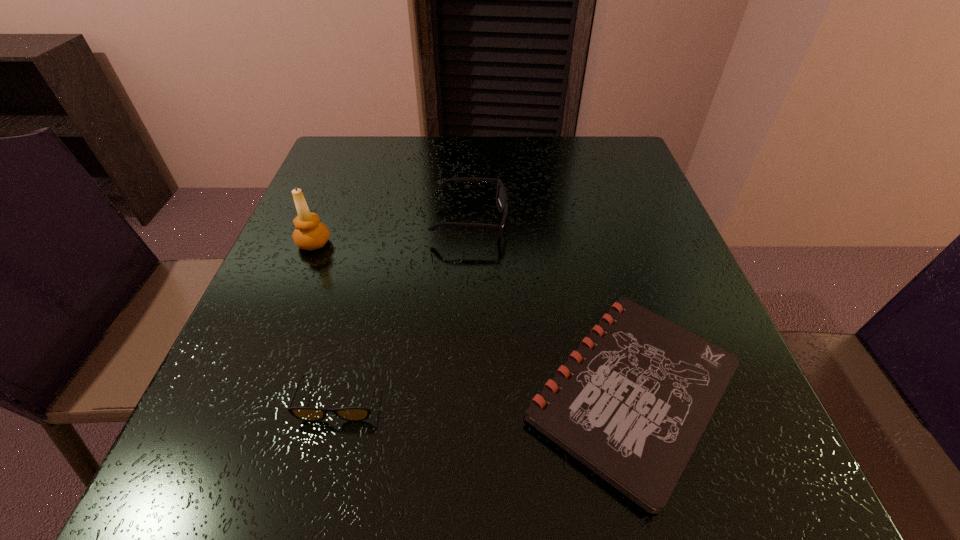
Where is `free spot between the nearer sunglasses and the notebook`? The image size is (960, 540). free spot between the nearer sunglasses and the notebook is located at coordinates (486, 396).

At what (x,y) coordinates should I click in order to perform the action: click on vacant area that lies between the notebook and the tallest object. Please return your answer as a coordinate pair (x, y). The height and width of the screenshot is (540, 960). Looking at the image, I should click on (473, 318).

The height and width of the screenshot is (540, 960). Find the location of `vacant region between the notebook and the taller sunglasses`. vacant region between the notebook and the taller sunglasses is located at coordinates (550, 306).

Where is `unoccupied area between the shortest object and the nearer sunglasses`? The height and width of the screenshot is (540, 960). unoccupied area between the shortest object and the nearer sunglasses is located at coordinates (486, 396).

Image resolution: width=960 pixels, height=540 pixels. I want to click on object that is the second nearest to the candle_holder, so point(313,414).

This screenshot has width=960, height=540. I want to click on object that stands as the second closest to the shortest object, so click(x=313, y=414).

You are a GUI agent. You are given a task and a screenshot of the screen. Output one action in this format:
    pyautogui.click(x=<x>, y=<y>)
    Task: Click on the vacant position in the image that satisfies the following two spatial constraints: 1. on the front-facing side of the farther sunglasses; 2. on the front-facing side of the nearer sunglasses
    
    Given the screenshot: What is the action you would take?
    pyautogui.click(x=465, y=401)

This screenshot has width=960, height=540. What are the coordinates of `vacant area that satisfies the following two spatial constraints: 1. on the front-facing side of the farther sunglasses; 2. on the front-facing side of the shorter sunglasses` in the screenshot? It's located at (465, 401).

The height and width of the screenshot is (540, 960). Find the location of `vacant space that satisfies the following two spatial constraints: 1. on the front-facing side of the third shortest object; 2. on the right side of the shortest object`. vacant space that satisfies the following two spatial constraints: 1. on the front-facing side of the third shortest object; 2. on the right side of the shortest object is located at coordinates (465, 392).

You are a GUI agent. You are given a task and a screenshot of the screen. Output one action in this format:
    pyautogui.click(x=<x>, y=<y>)
    Task: Click on the free location that satisfies the following two spatial constraints: 1. on the front-facing side of the second tallest object; 2. on the right side of the rightmost object
    This screenshot has width=960, height=540.
    Given the screenshot: What is the action you would take?
    pyautogui.click(x=465, y=392)